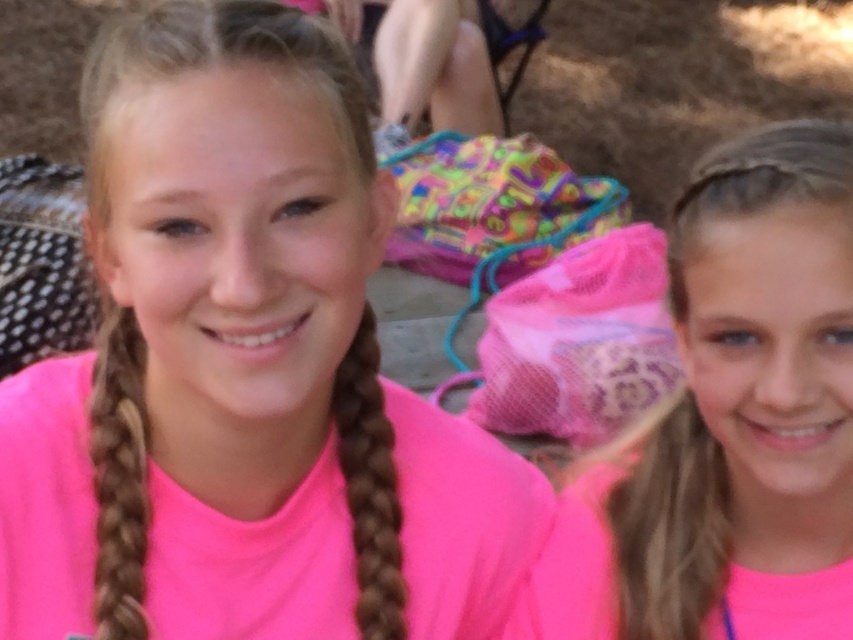
Is pink fabric hair at right thinner than brownbraided hair at left?

Indeed, pink fabric hair at right has a lesser width compared to brownbraided hair at left.

Where is `pink fabric hair at right`? pink fabric hair at right is located at coordinates (750, 400).

Identify the location of pink fabric hair at right. The width and height of the screenshot is (853, 640). (750, 400).

Who is higher up, brownbraided hair at left or brown braided hair at center?

brown braided hair at center is above.

Based on the photo, does brownbraided hair at left have a lesser width compared to brown braided hair at center?

No.

Find the location of a particular element. The width and height of the screenshot is (853, 640). brownbraided hair at left is located at coordinates (119, 477).

Between pink fabric shirt at center and pink fabric hair at right, which one appears on the right side from the viewer's perspective?

pink fabric hair at right is more to the right.

Which is in front, point (149, 348) or point (834, 586)?

Point (149, 348) is more forward.

You are a GUI agent. You are given a task and a screenshot of the screen. Output one action in this format:
    pyautogui.click(x=<x>, y=<y>)
    Task: Click on the pink fabric shirt at center
    This screenshot has width=853, height=640.
    Given the screenshot: What is the action you would take?
    pyautogui.click(x=234, y=298)